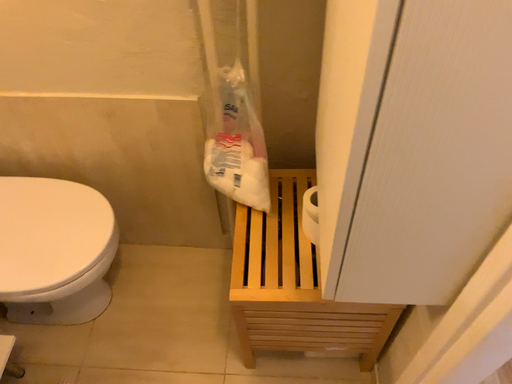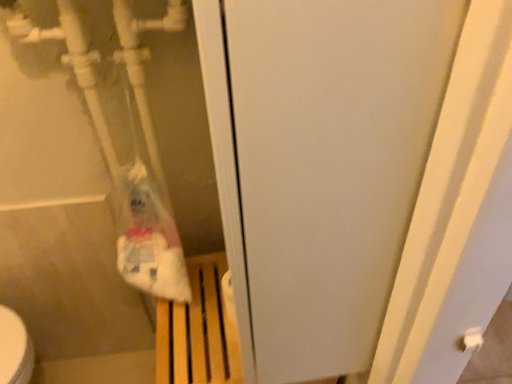
Question: Which way did the camera rotate in the video?

Choices:
 (A) rotated right
 (B) rotated left

Answer: (A)